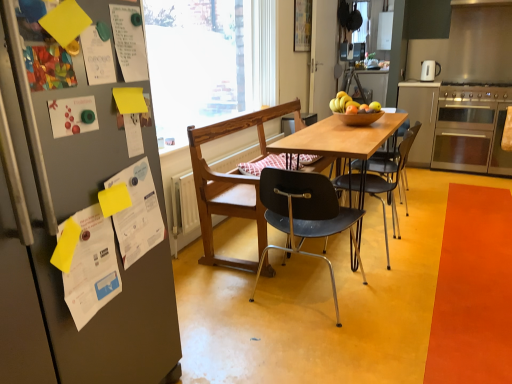
Where is `empty space that is ontop of orange matte mat at lower right (from a real-world perspective)`? The height and width of the screenshot is (384, 512). empty space that is ontop of orange matte mat at lower right (from a real-world perspective) is located at coordinates (482, 253).